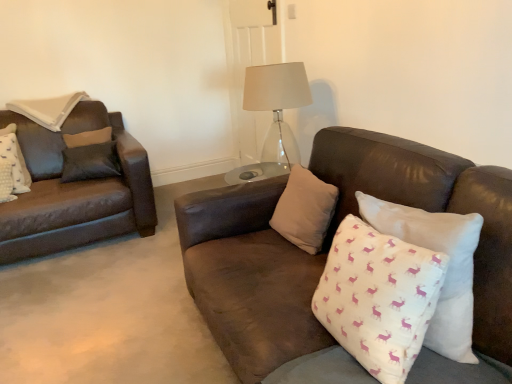
Question: Considering the positions of point (252, 74) and point (24, 175), is point (252, 74) closer or farther from the camera than point (24, 175)?

Choices:
 (A) closer
 (B) farther

Answer: (A)

Question: From a real-world perspective, is transparent glass table lamp at center above or below white textured pillow at left, which appears as the 4th pillow when viewed from the right?

Choices:
 (A) above
 (B) below

Answer: (A)

Question: Estimate the real-world distances between objects in this image. Which object is farther from the white cotton pillow with pink deer pattern at center, arranged as the 1th pillow when viewed from the right?

Choices:
 (A) white textured pillow at left, which appears as the 4th pillow when viewed from the right
 (B) beige fabric pillow at center, the second pillow from the left
 (C) transparent glass table lamp at center
 (D) white cotton cushion with pink deer pattern at right, which is the third pillow in left-to-right order

Answer: (A)

Question: Which of these objects is positioned closest to the transparent glass table lamp at center?

Choices:
 (A) white cotton pillow with pink deer pattern at center, the fourth pillow from the left
 (B) beige fabric pillow at center, the second pillow from the left
 (C) white textured pillow at left, which appears as the 4th pillow when viewed from the right
 (D) white cotton cushion with pink deer pattern at right, placed as the second pillow when sorted from right to left

Answer: (B)